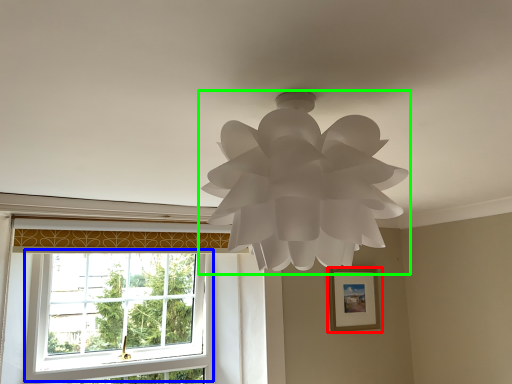
Question: Considering the real-world distances, which object is farthest from picture frame (highlighted by a red box)? window (highlighted by a blue box) or lamp (highlighted by a green box)?

Choices:
 (A) window
 (B) lamp

Answer: (B)